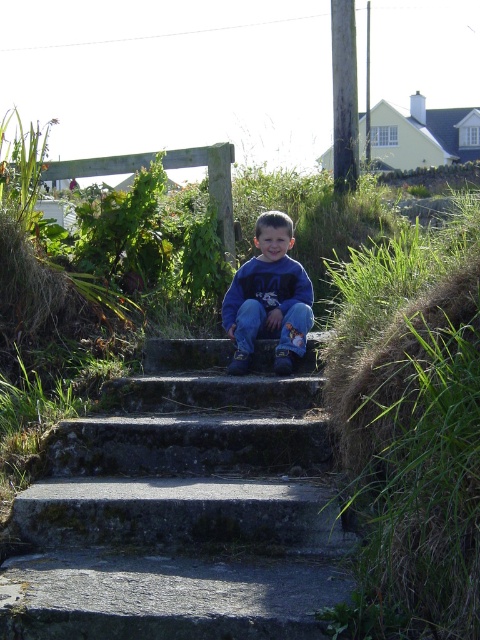
Question: Does concrete stairs at center have a smaller size compared to blue cotton sweatshirt at center?

Choices:
 (A) no
 (B) yes

Answer: (A)

Question: Does concrete stairs at center lie behind blue cotton sweatshirt at center?

Choices:
 (A) yes
 (B) no

Answer: (B)

Question: Among these objects, which one is farthest from the camera?

Choices:
 (A) blue cotton sweatshirt at center
 (B) concrete stairs at center

Answer: (A)

Question: Is concrete stairs at center bigger than blue cotton sweatshirt at center?

Choices:
 (A) yes
 (B) no

Answer: (A)